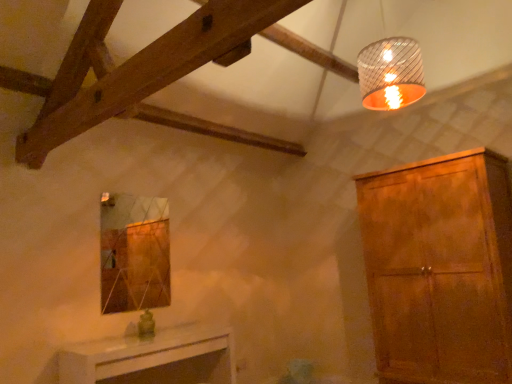
Question: Is metallic ribbed lampshade at upper right bigger than matte brown cabinet at right?

Choices:
 (A) no
 (B) yes

Answer: (A)

Question: From a real-world perspective, is metallic ribbed lampshade at upper right positioned under matte brown cabinet at right based on gravity?

Choices:
 (A) no
 (B) yes

Answer: (A)

Question: Can you confirm if metallic ribbed lampshade at upper right is wider than matte brown cabinet at right?

Choices:
 (A) no
 (B) yes

Answer: (A)

Question: Does metallic ribbed lampshade at upper right have a greater height compared to matte brown cabinet at right?

Choices:
 (A) yes
 (B) no

Answer: (B)

Question: Is metallic ribbed lampshade at upper right looking in the opposite direction of matte brown cabinet at right?

Choices:
 (A) no
 (B) yes

Answer: (A)

Question: Considering the relative sizes of metallic ribbed lampshade at upper right and matte brown cabinet at right in the image provided, is metallic ribbed lampshade at upper right thinner than matte brown cabinet at right?

Choices:
 (A) yes
 (B) no

Answer: (A)

Question: Is matte brown cabinet at right positioned beyond the bounds of white glossy table at lower center?

Choices:
 (A) yes
 (B) no

Answer: (A)

Question: Can you confirm if matte brown cabinet at right is positioned to the left of white glossy table at lower center?

Choices:
 (A) yes
 (B) no

Answer: (B)

Question: Is white glossy table at lower center at the back of matte brown cabinet at right?

Choices:
 (A) yes
 (B) no

Answer: (B)

Question: From a real-world perspective, does matte brown cabinet at right sit lower than white glossy table at lower center?

Choices:
 (A) no
 (B) yes

Answer: (A)

Question: Does matte brown cabinet at right have a larger size compared to white glossy table at lower center?

Choices:
 (A) yes
 (B) no

Answer: (A)

Question: From the image's perspective, does matte brown cabinet at right appear lower than white glossy table at lower center?

Choices:
 (A) no
 (B) yes

Answer: (A)

Question: Is matte brown cabinet at right closer to camera compared to metallic ribbed lampshade at upper right?

Choices:
 (A) no
 (B) yes

Answer: (A)